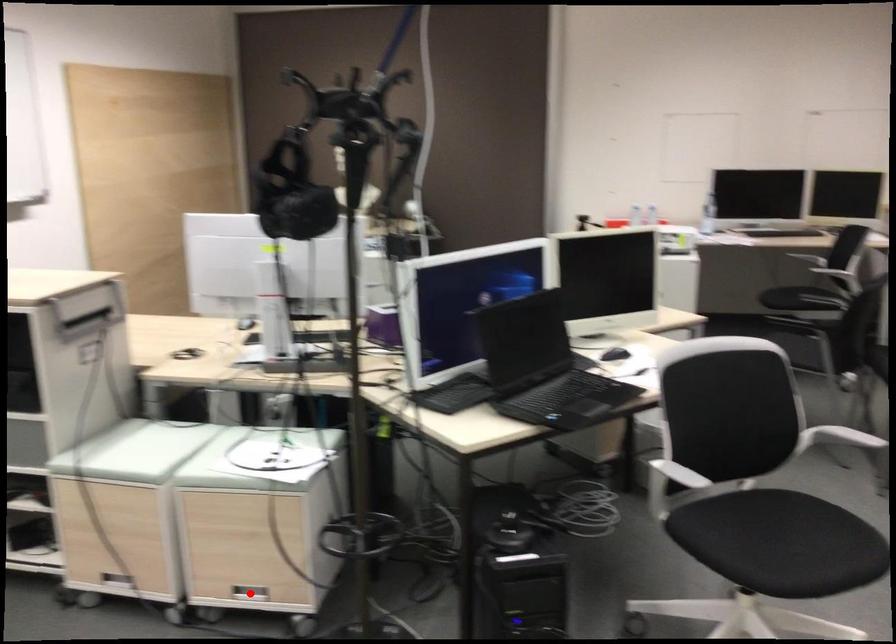
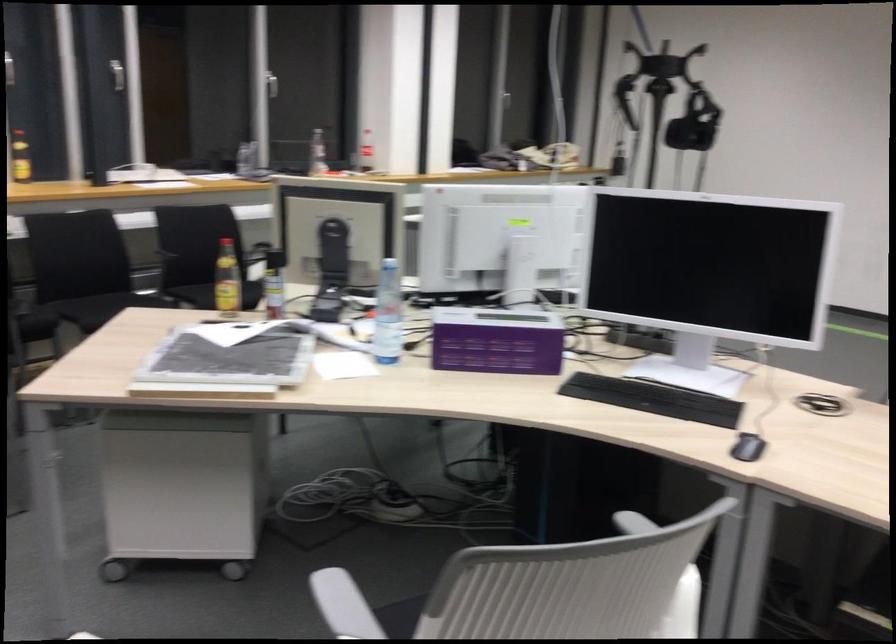
Question: I am providing you with two images of the same scene from different viewpoints. A red point is marked on the first image. At the location where the point appears in image 1, is it still visible in image 2?

Choices:
 (A) Yes
 (B) No

Answer: (B)